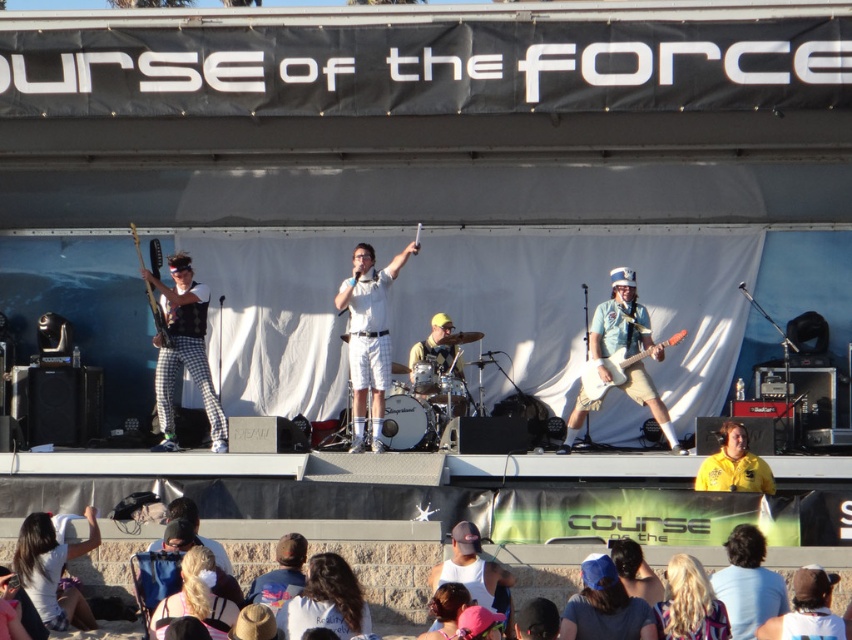
Based on the photo, does white matte shorts at center have a greater height compared to yellow shirt at center?

Yes.

At what (x,y) coordinates should I click in order to perform the action: click on white matte shorts at center. Please return your answer as a coordinate pair (x, y). Looking at the image, I should click on (367, 337).

The image size is (852, 640). What are the coordinates of `white matte shorts at center` in the screenshot? It's located at (367, 337).

Does white cotton shirt at lower left have a lesser width compared to dark brown leather hat at lower center?

No, white cotton shirt at lower left is not thinner than dark brown leather hat at lower center.

In the scene shown: Can you confirm if white cotton shirt at lower left is bigger than dark brown leather hat at lower center?

Yes.

I want to click on white cotton shirt at lower left, so [52, 570].

Locate an element on the screen. white cotton shirt at lower left is located at coordinates (52, 570).

Can you confirm if white matte guitar at center is taller than matte black guitar at left?

No.

Is white matte guitar at center wider than matte black guitar at left?

Indeed, white matte guitar at center has a greater width compared to matte black guitar at left.

Who is more forward, [596,396] or [206,371]?

Positioned in front is point [596,396].

The height and width of the screenshot is (640, 852). In order to click on white matte guitar at center in this screenshot , I will do `click(620, 358)`.